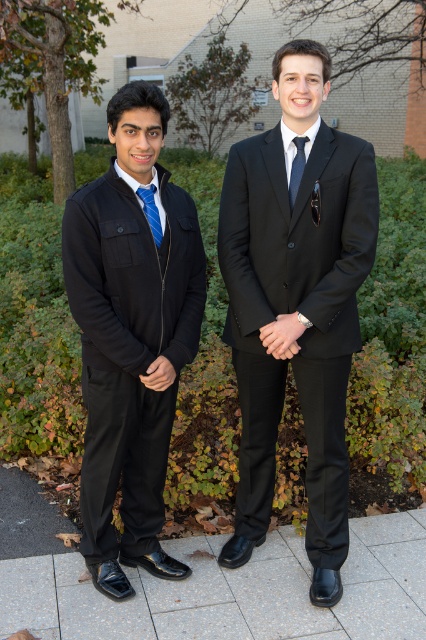
Question: Which is farther from the black satin suit at center?

Choices:
 (A) gray concrete pavement at lower center
 (B) blue striped tie at left

Answer: (A)

Question: Among these points, which one is farthest from the camera?

Choices:
 (A) (327, 534)
 (B) (150, 200)
 (C) (264, 189)

Answer: (A)

Question: Does gray concrete pavement at lower center have a smaller size compared to dark blue silk tie at center?

Choices:
 (A) yes
 (B) no

Answer: (B)

Question: Is matte black jacket at left above blue striped tie at left?

Choices:
 (A) yes
 (B) no

Answer: (B)

Question: Among these objects, which one is farthest from the camera?

Choices:
 (A) black satin suit at center
 (B) dark blue silk tie at center
 (C) matte black jacket at left
 (D) matte black suit at center

Answer: (B)

Question: Is matte black suit at center smaller than black satin suit at center?

Choices:
 (A) no
 (B) yes

Answer: (A)